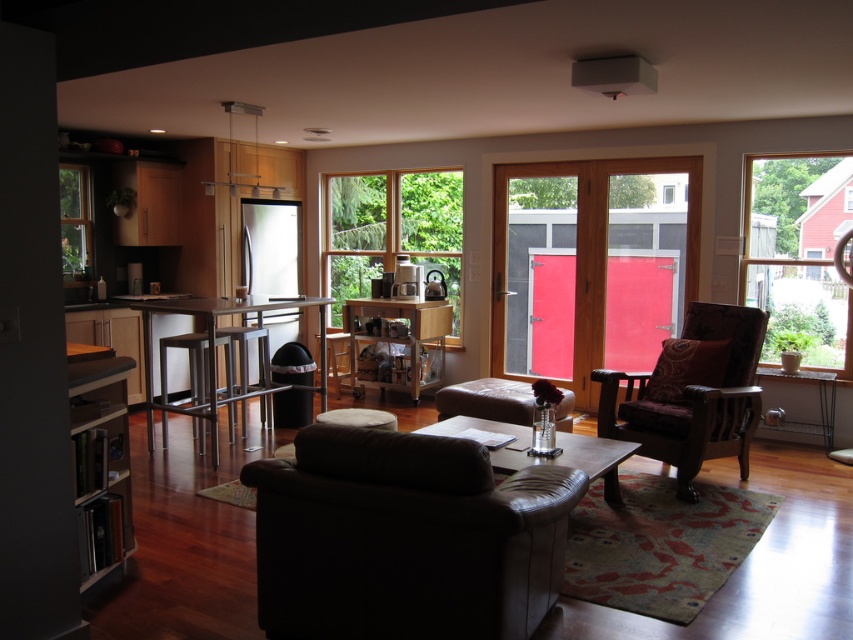
Question: Where is clear glass window at center located in relation to white fabric stool at center in the image?

Choices:
 (A) below
 (B) above

Answer: (B)

Question: Which object is farther from the camera taking this photo?

Choices:
 (A) transparent glass window at right
 (B) brown velvet armchair at right
 (C) leather couch at center

Answer: (A)

Question: Does leather couch at center appear on the left side of clear glass window at center?

Choices:
 (A) no
 (B) yes

Answer: (A)

Question: Is red glass door at center to the right of transparent glass window at right from the viewer's perspective?

Choices:
 (A) yes
 (B) no

Answer: (B)

Question: Which point is farther to the camera?

Choices:
 (A) (61, 182)
 (B) (347, 278)
 (C) (569, 308)

Answer: (B)

Question: Which object is farther from the camera taking this photo?

Choices:
 (A) clear glass window at upper left
 (B) leather couch at center
 (C) red glass door at center

Answer: (A)